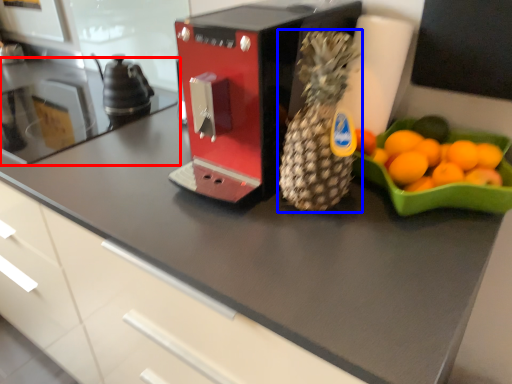
Question: Which point is closer to the camera, countertop (highlighted by a red box) or pineapple (highlighted by a blue box)?

Choices:
 (A) countertop
 (B) pineapple

Answer: (B)